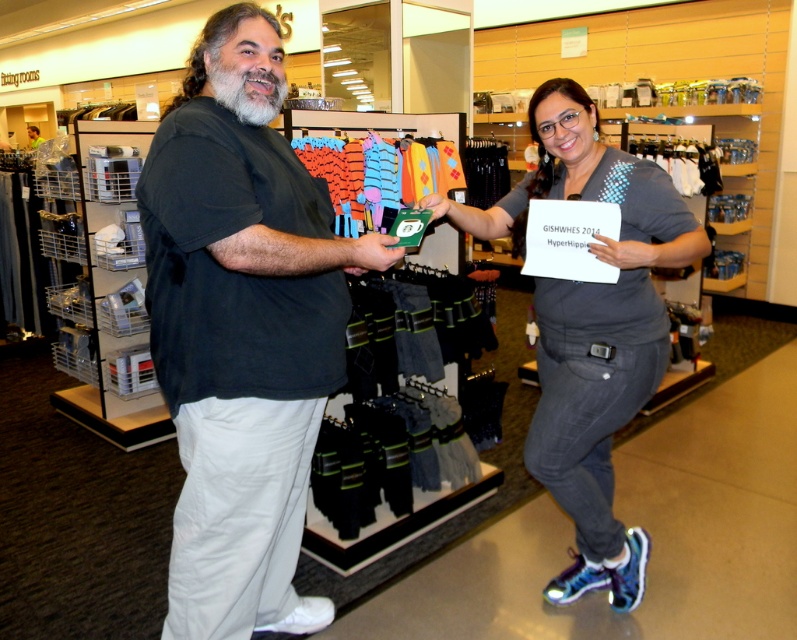
What item is located at the coordinates point (x=241, y=330)?

The black matte t shirt at center is located at point (x=241, y=330).